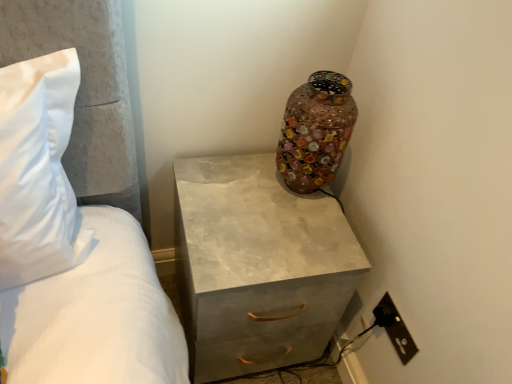
Measure the distance between multicolored mosaic vase at upper right and camera.

34.16 inches.

Image resolution: width=512 pixels, height=384 pixels. What do you see at coordinates (395, 328) in the screenshot? I see `black plastic outlet at lower right` at bounding box center [395, 328].

Locate an element on the screen. Image resolution: width=512 pixels, height=384 pixels. multicolored mosaic vase at upper right is located at coordinates 315,131.

Considering the relative sizes of multicolored mosaic vase at upper right and matte concrete chest of drawers at center in the image provided, is multicolored mosaic vase at upper right wider than matte concrete chest of drawers at center?

In fact, multicolored mosaic vase at upper right might be narrower than matte concrete chest of drawers at center.

Is multicolored mosaic vase at upper right further to camera compared to matte concrete chest of drawers at center?

Yes, the depth of multicolored mosaic vase at upper right is greater than that of matte concrete chest of drawers at center.

Would you say matte concrete chest of drawers at center is part of multicolored mosaic vase at upper right's contents?

No, matte concrete chest of drawers at center is not surrounded by multicolored mosaic vase at upper right.

Can you confirm if multicolored mosaic vase at upper right is bigger than matte concrete chest of drawers at center?

Incorrect, multicolored mosaic vase at upper right is not larger than matte concrete chest of drawers at center.

Considering the points (218, 308) and (385, 301), which point is in front, point (218, 308) or point (385, 301)?

The point (218, 308) is in front.

From the image's perspective, which object appears higher, matte concrete chest of drawers at center or black plastic outlet at lower right?

matte concrete chest of drawers at center, from the image's perspective.

Is matte concrete chest of drawers at center wider or thinner than black plastic outlet at lower right?

Considering their sizes, matte concrete chest of drawers at center looks broader than black plastic outlet at lower right.

Is matte concrete chest of drawers at center positioned with its back to black plastic outlet at lower right?

No, matte concrete chest of drawers at center is not facing away from black plastic outlet at lower right.

From a real-world perspective, is multicolored mosaic vase at upper right on top of black plastic outlet at lower right?

Yes, from a real-world perspective, multicolored mosaic vase at upper right is over black plastic outlet at lower right

Is multicolored mosaic vase at upper right looking in the opposite direction of black plastic outlet at lower right?

No, multicolored mosaic vase at upper right's orientation is not away from black plastic outlet at lower right.

Could black plastic outlet at lower right be considered to be inside multicolored mosaic vase at upper right?

Definitely not — black plastic outlet at lower right is not inside multicolored mosaic vase at upper right.

Is the depth of multicolored mosaic vase at upper right less than that of black plastic outlet at lower right?

Yes.

In terms of width, does matte concrete chest of drawers at center look wider or thinner when compared to multicolored mosaic vase at upper right?

Considering their sizes, matte concrete chest of drawers at center looks broader than multicolored mosaic vase at upper right.

Does matte concrete chest of drawers at center turn towards multicolored mosaic vase at upper right?

No.

From the image's perspective, who appears lower, matte concrete chest of drawers at center or multicolored mosaic vase at upper right?

matte concrete chest of drawers at center.

Would you consider matte concrete chest of drawers at center to be distant from multicolored mosaic vase at upper right?

matte concrete chest of drawers at center is near multicolored mosaic vase at upper right, not far away.

Is black plastic outlet at lower right in front of or behind matte concrete chest of drawers at center in the image?

In the image, black plastic outlet at lower right appears behind matte concrete chest of drawers at center.

Between point (402, 329) and point (200, 220), which one is positioned behind?

The point (200, 220) is farther.

Is black plastic outlet at lower right wider than matte concrete chest of drawers at center?

Incorrect, the width of black plastic outlet at lower right does not surpass that of matte concrete chest of drawers at center.

Looking at this image, would you say black plastic outlet at lower right is inside or outside matte concrete chest of drawers at center?

black plastic outlet at lower right lies outside matte concrete chest of drawers at center.

From a real-world perspective, is black plastic outlet at lower right physically located above or below multicolored mosaic vase at upper right?

In terms of real-world spatial position, black plastic outlet at lower right is below multicolored mosaic vase at upper right.

Looking at this image, based on their sizes in the image, would you say black plastic outlet at lower right is bigger or smaller than multicolored mosaic vase at upper right?

Clearly, black plastic outlet at lower right is smaller in size than multicolored mosaic vase at upper right.

Is black plastic outlet at lower right facing away from multicolored mosaic vase at upper right?

That's not correct — black plastic outlet at lower right is not looking away from multicolored mosaic vase at upper right.

You are a GUI agent. You are given a task and a screenshot of the screen. Output one action in this format:
    pyautogui.click(x=<x>, y=<y>)
    Task: Click on the vase that is on the left side of black plastic outlet at lower right
    
    Given the screenshot: What is the action you would take?
    pyautogui.click(x=315, y=131)

Find the location of a particular element. vase located on the right of matte concrete chest of drawers at center is located at coordinates (315, 131).

Where is `chest of drawers below the black plastic outlet at lower right (from a real-world perspective)`? chest of drawers below the black plastic outlet at lower right (from a real-world perspective) is located at coordinates (258, 266).

Considering their positions, is black plastic outlet at lower right positioned closer to matte concrete chest of drawers at center than multicolored mosaic vase at upper right?

Based on the image, multicolored mosaic vase at upper right appears to be nearer to matte concrete chest of drawers at center.

Which object lies nearer to the anchor point multicolored mosaic vase at upper right, black plastic outlet at lower right or matte concrete chest of drawers at center?

matte concrete chest of drawers at center lies closer to multicolored mosaic vase at upper right than the other object.

Estimate the real-world distances between objects in this image. Which object is further from black plastic outlet at lower right, multicolored mosaic vase at upper right or matte concrete chest of drawers at center?

Based on the image, multicolored mosaic vase at upper right appears to be further to black plastic outlet at lower right.

Looking at this image, considering their positions, is matte concrete chest of drawers at center positioned further to black plastic outlet at lower right than multicolored mosaic vase at upper right?

Among the two, multicolored mosaic vase at upper right is located further to black plastic outlet at lower right.

Considering their positions, is multicolored mosaic vase at upper right positioned further to matte concrete chest of drawers at center than black plastic outlet at lower right?

black plastic outlet at lower right is further to matte concrete chest of drawers at center.

Looking at the image, which one is located closer to multicolored mosaic vase at upper right, matte concrete chest of drawers at center or black plastic outlet at lower right?

Among the two, matte concrete chest of drawers at center is located nearer to multicolored mosaic vase at upper right.

This screenshot has width=512, height=384. In order to click on the chest of drawers between multicolored mosaic vase at upper right and black plastic outlet at lower right vertically in this screenshot , I will do `click(258, 266)`.